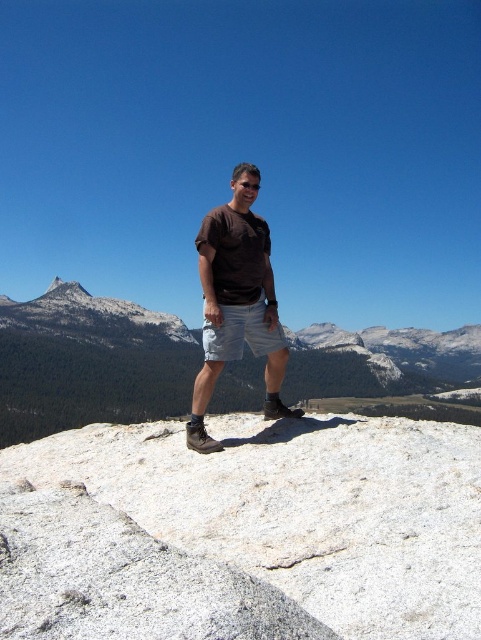
You are a photographer trying to capture the perfect shot of the white cotton shorts at center. To ensure the shorts are in the center of the photo, where should you position your camera? Please provide coordinates based on the image grid where the center is at point 1.0,1.0 and the bottom left is at 0.0,0.0.

The white cotton shorts at center are located at coordinates (240, 332), so to center them in the photo, position your camera at those coordinates.